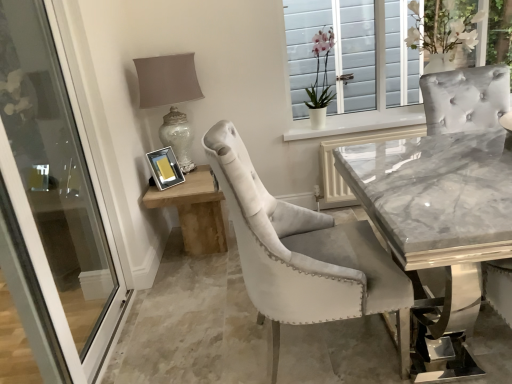
Question: From a real-world perspective, is velvet chair at center located beneath wooden side table at lower left?

Choices:
 (A) yes
 (B) no

Answer: (A)

Question: Is velvet chair at center placed right next to wooden side table at lower left?

Choices:
 (A) no
 (B) yes

Answer: (A)

Question: Is velvet chair at center aimed at wooden side table at lower left?

Choices:
 (A) no
 (B) yes

Answer: (A)

Question: Is velvet chair at center taller than wooden side table at lower left?

Choices:
 (A) yes
 (B) no

Answer: (B)

Question: From the image's perspective, does velvet chair at center appear higher than wooden side table at lower left?

Choices:
 (A) yes
 (B) no

Answer: (B)

Question: Can you confirm if velvet chair at center is smaller than wooden side table at lower left?

Choices:
 (A) no
 (B) yes

Answer: (A)

Question: Is velvet chair at center at the back of matte silver table lamp at upper left?

Choices:
 (A) yes
 (B) no

Answer: (B)

Question: Is there a large distance between matte silver table lamp at upper left and velvet chair at center?

Choices:
 (A) yes
 (B) no

Answer: (A)

Question: Is matte silver table lamp at upper left completely or partially outside of velvet chair at center?

Choices:
 (A) yes
 (B) no

Answer: (A)

Question: Does matte silver table lamp at upper left have a smaller size compared to velvet chair at center?

Choices:
 (A) no
 (B) yes

Answer: (B)

Question: Does matte silver table lamp at upper left have a greater width compared to velvet chair at center?

Choices:
 (A) no
 (B) yes

Answer: (A)

Question: Considering the relative sizes of matte silver table lamp at upper left and velvet chair at center in the image provided, is matte silver table lamp at upper left thinner than velvet chair at center?

Choices:
 (A) yes
 (B) no

Answer: (A)

Question: Does velvet chair at center have a greater height compared to pink velvet orchid at upper center?

Choices:
 (A) yes
 (B) no

Answer: (B)